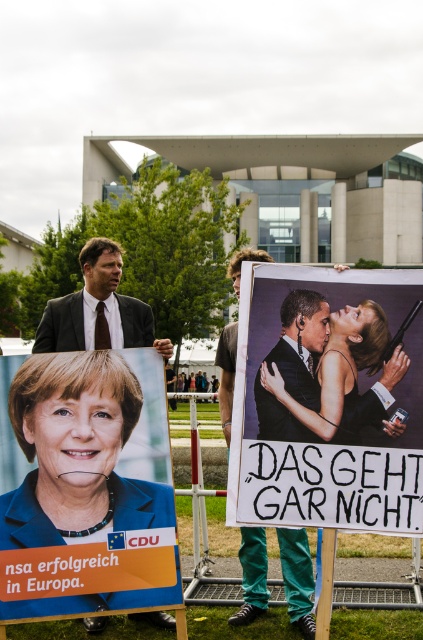
Question: Among these points, which one is farthest from the camera?

Choices:
 (A) (263, 576)
 (B) (324, 346)
 (C) (82, 250)

Answer: (C)

Question: Which point is farther from the camera taking this photo?

Choices:
 (A) (312, 376)
 (B) (65, 330)

Answer: (B)

Question: Which point appears farthest from the camera in this image?

Choices:
 (A) (63, 328)
 (B) (301, 428)
 (C) (310, 316)
 (D) (126, 589)

Answer: (A)

Question: Is matte orange poster at lower left to the right of matte black suit at center from the viewer's perspective?

Choices:
 (A) no
 (B) yes

Answer: (A)

Question: Considering the relative positions of matte black suit at center and dark brown suit at center in the image provided, where is matte black suit at center located with respect to dark brown suit at center?

Choices:
 (A) above
 (B) below

Answer: (B)

Question: Does matte black suit at center appear on the right side of dark brown suit at center?

Choices:
 (A) yes
 (B) no

Answer: (A)